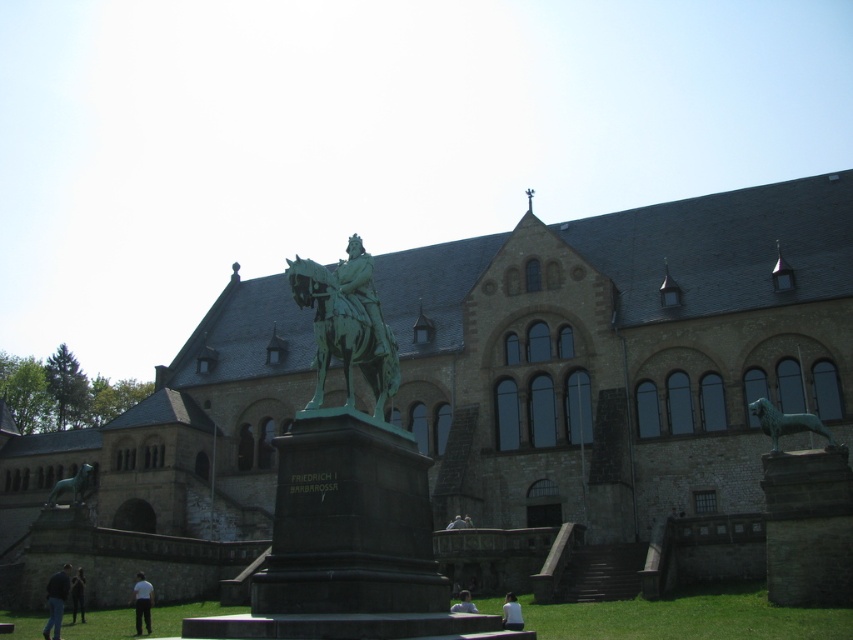
Question: Which point is closer to the camera?

Choices:
 (A) (451, 524)
 (B) (762, 195)

Answer: (A)

Question: Which of the following is the farthest from the observer?

Choices:
 (A) (502, 308)
 (B) (456, 522)
 (C) (80, 480)
 (D) (804, 429)

Answer: (A)

Question: In this image, where is bronze horse at right located relative to light brown leather jacket at lower center?

Choices:
 (A) left
 (B) right

Answer: (B)

Question: Is dark blue jeans at lower left above light blue shirt at lower center?

Choices:
 (A) no
 (B) yes

Answer: (A)

Question: Among these points, which one is farthest from the camera?

Choices:
 (A) (585, 330)
 (B) (146, 632)
 (C) (325, 298)

Answer: (A)

Question: Is green polished bronze statue at center bigger than white cotton shirt at lower left?

Choices:
 (A) yes
 (B) no

Answer: (A)